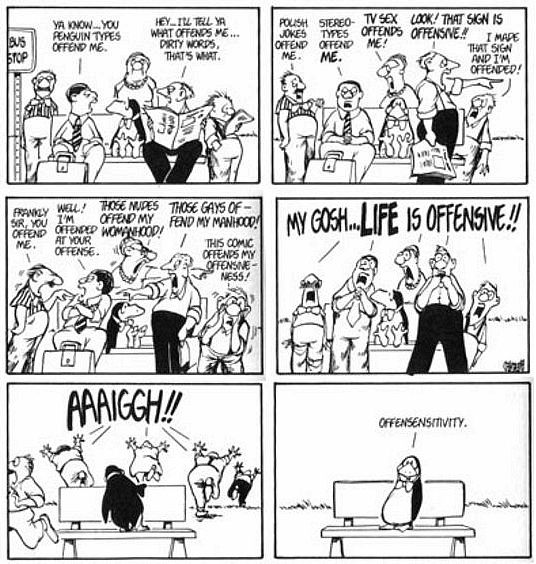
Find the location of `panels`. panels is located at coordinates (138, 109), (358, 90), (414, 284), (100, 277), (132, 422), (389, 445).